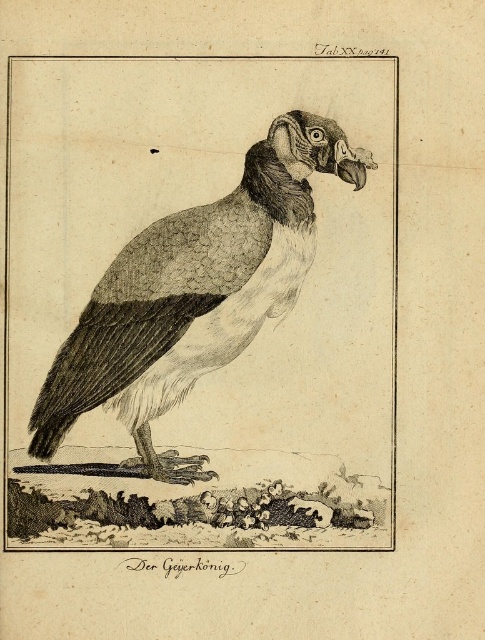
Question: Is gray textured vulture at center smaller than matte black beak at upper center?

Choices:
 (A) no
 (B) yes

Answer: (A)

Question: Is gray textured vulture at center smaller than matte black beak at upper center?

Choices:
 (A) yes
 (B) no

Answer: (B)

Question: Can you confirm if gray textured vulture at center is positioned to the right of matte black beak at upper center?

Choices:
 (A) yes
 (B) no

Answer: (B)